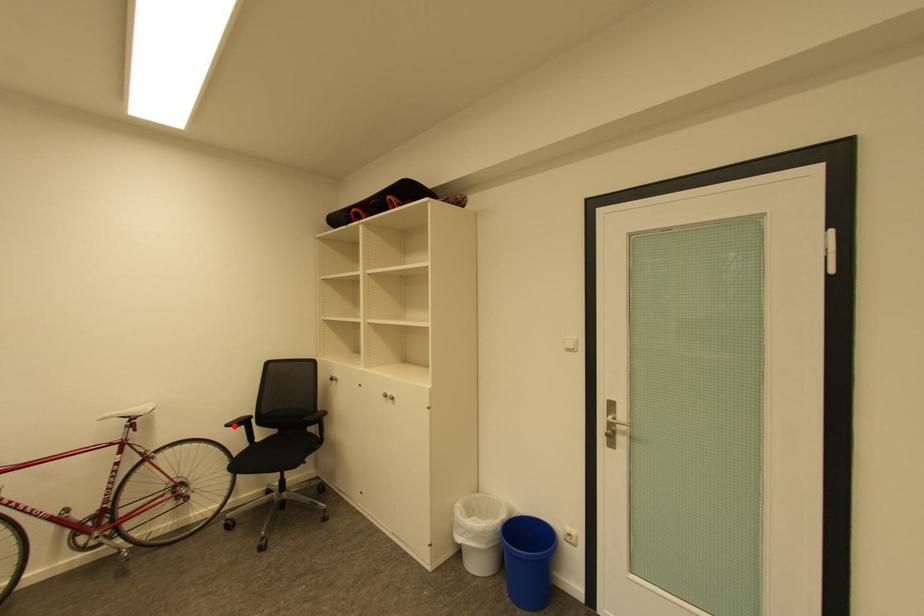
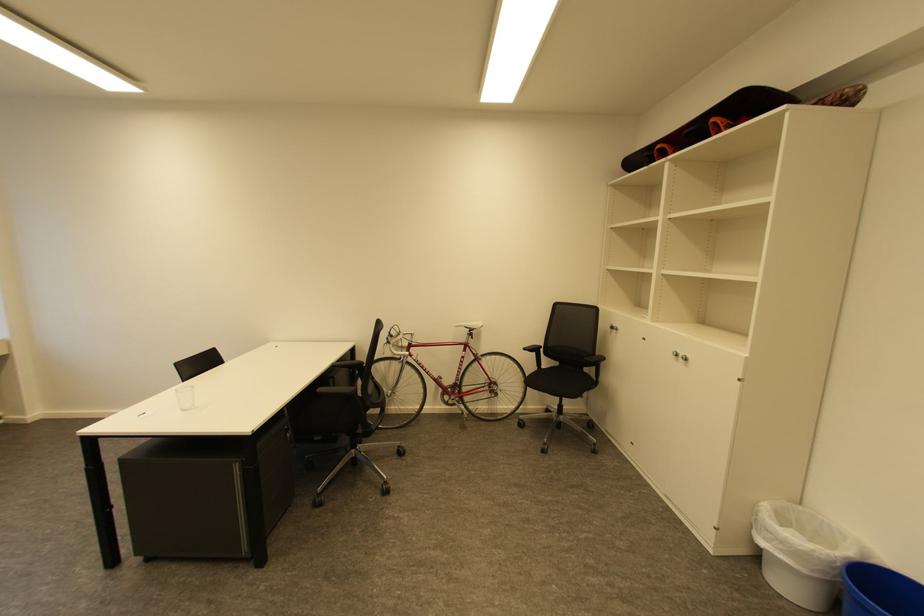
Question: I am providing you with two images of the same scene from different viewpoints. A red point is marked on the first image. Is the red point's position out of view in image 2?

Choices:
 (A) Yes
 (B) No

Answer: (B)